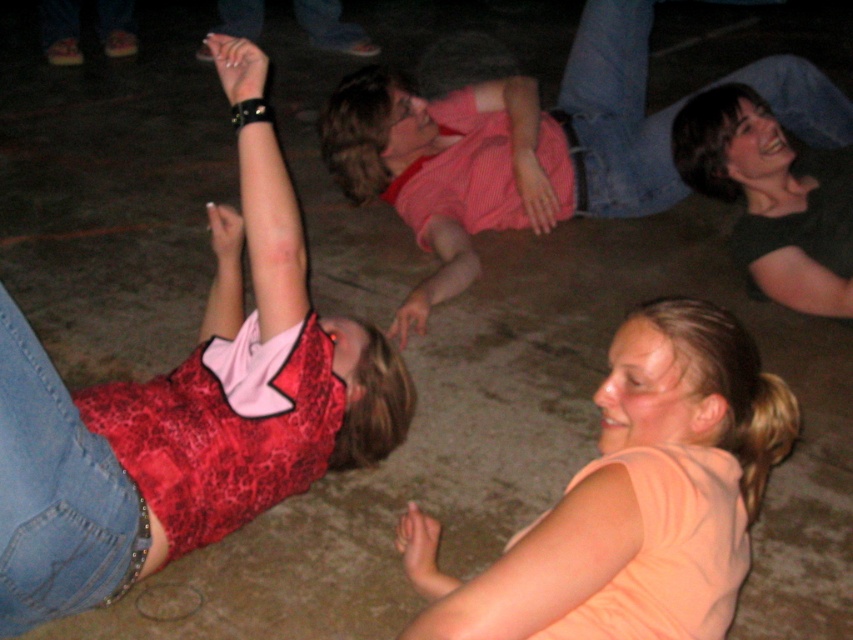
Question: Among these objects, which one is farthest from the camera?

Choices:
 (A) red lace tank top at upper left
 (B) pink lace shirt at center
 (C) orange fabric shirt at lower right

Answer: (B)

Question: Can you confirm if red lace tank top at upper left is positioned below orange fabric shirt at lower right?

Choices:
 (A) yes
 (B) no

Answer: (B)

Question: Can you confirm if red lace tank top at upper left is positioned above pink lace shirt at center?

Choices:
 (A) yes
 (B) no

Answer: (B)

Question: Which is nearer to the red lace tank top at upper left?

Choices:
 (A) orange fabric shirt at lower right
 (B) pink lace shirt at center

Answer: (A)

Question: Which object is farther from the camera taking this photo?

Choices:
 (A) red lace tank top at upper left
 (B) orange fabric shirt at lower right
 (C) pink lace shirt at center

Answer: (C)

Question: Can you confirm if red lace tank top at upper left is positioned below pink lace shirt at center?

Choices:
 (A) no
 (B) yes

Answer: (B)